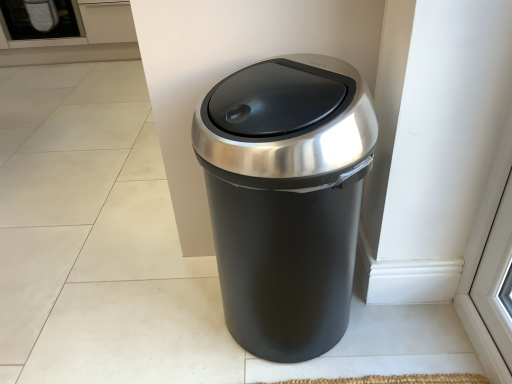
This screenshot has height=384, width=512. Find the location of `black matte trash can at center`. black matte trash can at center is located at coordinates (286, 198).

What is the approximate height of black matte trash can at center?

black matte trash can at center is 26.45 inches tall.

What is the approximate width of black matte trash can at center?

It is 15.11 inches.

What do you see at coordinates (286, 198) in the screenshot? The width and height of the screenshot is (512, 384). I see `black matte trash can at center` at bounding box center [286, 198].

The height and width of the screenshot is (384, 512). Describe the element at coordinates (40, 19) in the screenshot. I see `white frosted glass screen door at upper left` at that location.

Locate an element on the screen. The height and width of the screenshot is (384, 512). white frosted glass screen door at upper left is located at coordinates (40, 19).

Locate an element on the screen. The width and height of the screenshot is (512, 384). black matte trash can at center is located at coordinates (286, 198).

Consider the image. Is black matte trash can at center to the left of white frosted glass screen door at upper left from the viewer's perspective?

Incorrect, black matte trash can at center is not on the left side of white frosted glass screen door at upper left.

Is black matte trash can at center behind white frosted glass screen door at upper left?

No, black matte trash can at center is closer to the viewer.

Is point (285, 330) positioned after point (4, 21)?

No, it is not.

From the image's perspective, which one is positioned higher, black matte trash can at center or white frosted glass screen door at upper left?

white frosted glass screen door at upper left.

From a real-world perspective, which is physically below, black matte trash can at center or white frosted glass screen door at upper left?

black matte trash can at center.

Between black matte trash can at center and white frosted glass screen door at upper left, which one has larger width?

white frosted glass screen door at upper left.

Does black matte trash can at center have a greater height compared to white frosted glass screen door at upper left?

Correct, black matte trash can at center is much taller as white frosted glass screen door at upper left.

Considering the relative sizes of black matte trash can at center and white frosted glass screen door at upper left in the image provided, is black matte trash can at center smaller than white frosted glass screen door at upper left?

Indeed, black matte trash can at center has a smaller size compared to white frosted glass screen door at upper left.

Is black matte trash can at center spatially inside white frosted glass screen door at upper left, or outside of it?

black matte trash can at center is not inside white frosted glass screen door at upper left, it's outside.

Is black matte trash can at center far away from white frosted glass screen door at upper left?

black matte trash can at center is far away from white frosted glass screen door at upper left.

Is black matte trash can at center positioned with its back to white frosted glass screen door at upper left?

No, black matte trash can at center is not facing the opposite direction of white frosted glass screen door at upper left.

I want to click on screen door lying on the left of black matte trash can at center, so click(40, 19).

Is white frosted glass screen door at upper left at the right side of black matte trash can at center?

No.

Which object is further away from the camera taking this photo, white frosted glass screen door at upper left or black matte trash can at center?

white frosted glass screen door at upper left is more distant.

Which is nearer, (21, 39) or (324, 257)?

Point (21, 39).

From the image's perspective, between white frosted glass screen door at upper left and black matte trash can at center, who is located below?

black matte trash can at center appears lower in the image.

From a real-world perspective, is white frosted glass screen door at upper left over black matte trash can at center?

Yes.

Which object is thinner, white frosted glass screen door at upper left or black matte trash can at center?

black matte trash can at center.

Does white frosted glass screen door at upper left have a greater height compared to black matte trash can at center?

Incorrect, the height of white frosted glass screen door at upper left is not larger of that of black matte trash can at center.

Considering the relative sizes of white frosted glass screen door at upper left and black matte trash can at center in the image provided, is white frosted glass screen door at upper left smaller than black matte trash can at center?

No.

Do you think white frosted glass screen door at upper left is within black matte trash can at center, or outside of it?

white frosted glass screen door at upper left is spatially situated outside black matte trash can at center.

Is there a large distance between white frosted glass screen door at upper left and black matte trash can at center?

Absolutely, white frosted glass screen door at upper left is distant from black matte trash can at center.

Is white frosted glass screen door at upper left looking in the opposite direction of black matte trash can at center?

white frosted glass screen door at upper left is not turned away from black matte trash can at center.

How different are the orientations of white frosted glass screen door at upper left and black matte trash can at center in degrees?

They differ by 89.2 degrees in their facing directions.

Could you measure the distance between white frosted glass screen door at upper left and black matte trash can at center?

white frosted glass screen door at upper left is 2.77 meters away from black matte trash can at center.

What are the coordinates of `screen door lying above the black matte trash can at center (from the image's perspective)` in the screenshot? It's located at (40, 19).

Locate an element on the screen. screen door behind the black matte trash can at center is located at coordinates (40, 19).

What are the coordinates of `waste container located below the white frosted glass screen door at upper left (from the image's perspective)` in the screenshot? It's located at (286, 198).